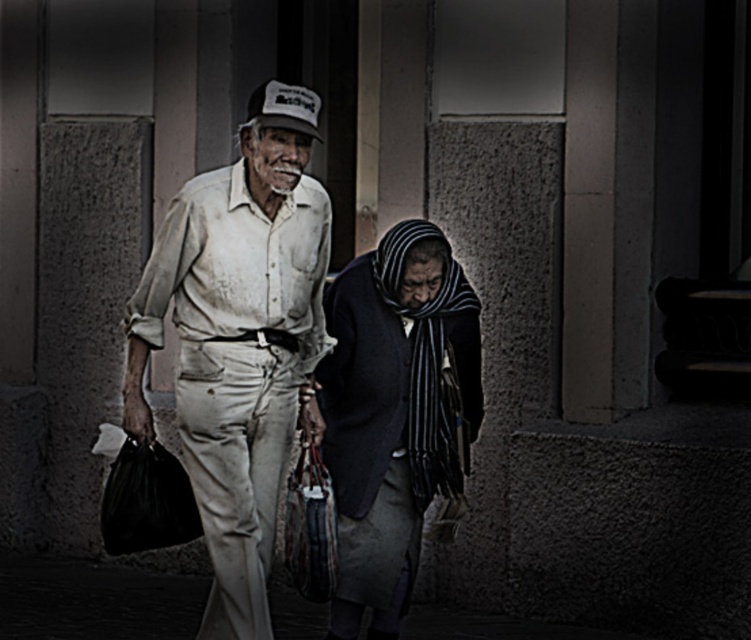
Question: Can you confirm if worn beige pants at center is smaller than dark blue woolen scarf at center?

Choices:
 (A) no
 (B) yes

Answer: (A)

Question: Which object is closer to the camera taking this photo?

Choices:
 (A) dark blue woolen scarf at center
 (B) worn beige pants at center

Answer: (B)

Question: Can you confirm if worn beige pants at center is positioned above dark blue woolen scarf at center?

Choices:
 (A) no
 (B) yes

Answer: (B)

Question: Does worn beige pants at center appear over dark blue woolen scarf at center?

Choices:
 (A) no
 (B) yes

Answer: (B)